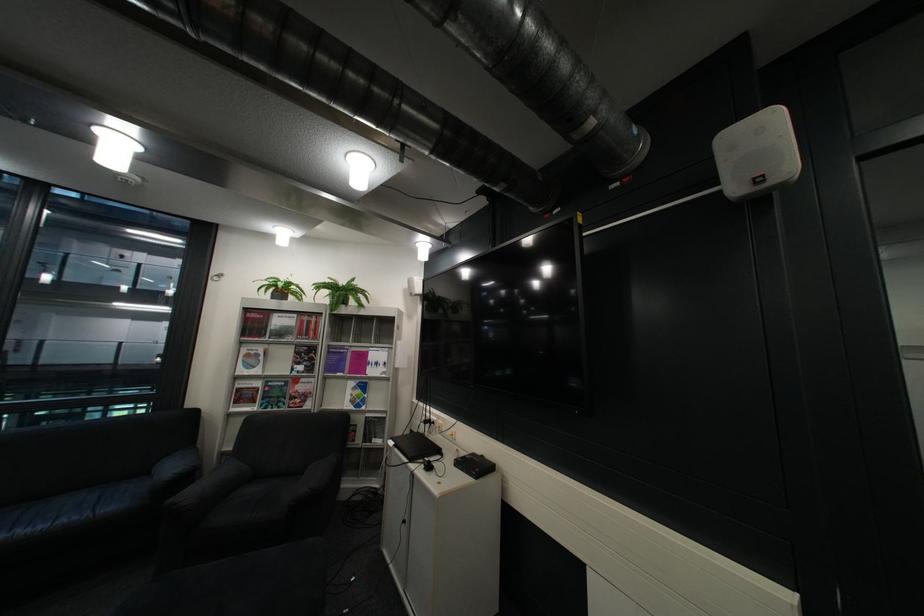
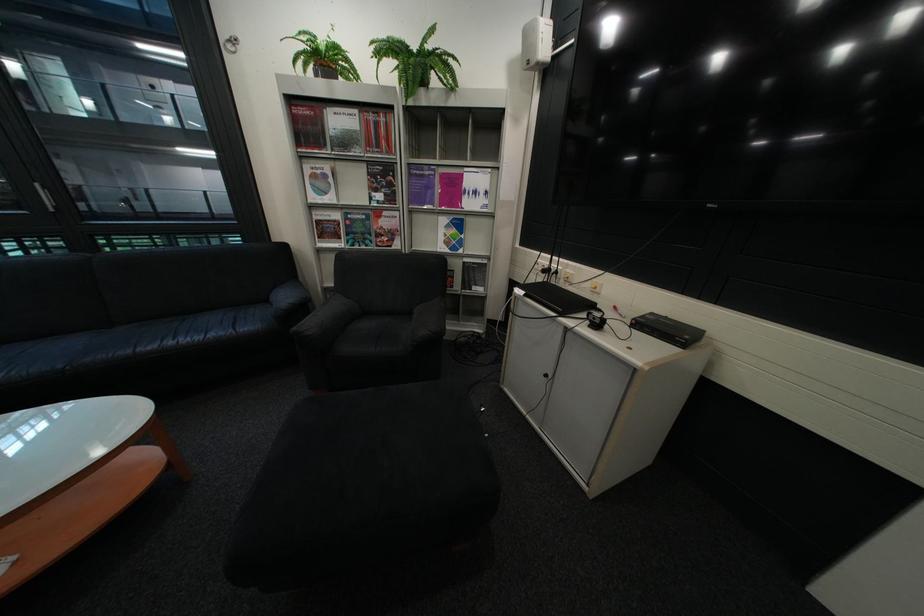
Locate, in the second image, the point that corresponds to (x=386, y=371) in the first image.

(484, 204)